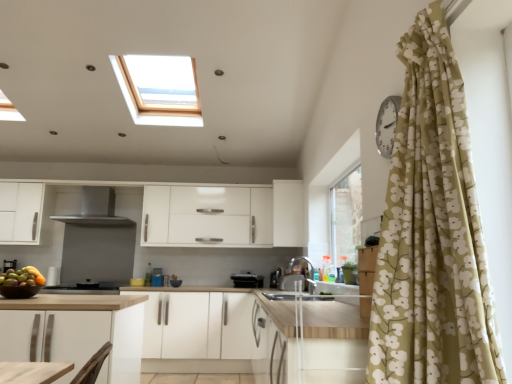
This screenshot has width=512, height=384. What do you see at coordinates (247, 280) in the screenshot?
I see `black plastic toaster at center, the fourth appliance in the top-to-bottom sequence` at bounding box center [247, 280].

What is the approximate width of white matte cabinet at center, placed as the 1th cabinetry when sorted from left to right?

white matte cabinet at center, placed as the 1th cabinetry when sorted from left to right, is 24.58 inches wide.

The height and width of the screenshot is (384, 512). What do you see at coordinates (275, 278) in the screenshot?
I see `satin black toaster at center, the 2th appliance in the bottom-to-top sequence` at bounding box center [275, 278].

I want to click on black plastic toaster at center, which is the 5th appliance from front to back, so click(x=247, y=280).

In the scene shown: What's the angular difference between black matte stove at lower center, which ranks as the sixth appliance in right-to-left order, and white matte cabinet at center, acting as the 2th cabinetry starting from the bottom,'s facing directions?

The angle between the facing direction of black matte stove at lower center, which ranks as the sixth appliance in right-to-left order, and the facing direction of white matte cabinet at center, acting as the 2th cabinetry starting from the bottom, is 90.3 degrees.

Is black matte stove at lower center, the 1th appliance viewed from the left, positioned far away from white matte cabinet at center, acting as the 2th cabinetry starting from the bottom?

black matte stove at lower center, the 1th appliance viewed from the left, is far away from white matte cabinet at center, acting as the 2th cabinetry starting from the bottom.

From the picture: From a real-world perspective, who is located higher, black matte stove at lower center, acting as the 1th appliance starting from the bottom, or white matte cabinet at center, marked as the second cabinetry in a left-to-right arrangement?

white matte cabinet at center, marked as the second cabinetry in a left-to-right arrangement.

From the image's perspective, would you say black matte stove at lower center, acting as the 1th appliance starting from the bottom, is shown under white matte cabinet at center, acting as the 2th cabinetry starting from the bottom?

Yes.

Can you confirm if white matte cabinet at center, which is counted as the first cabinetry, starting from the top, is bigger than black matte stove at lower center, acting as the 3th appliance starting from the back?

Indeed, white matte cabinet at center, which is counted as the first cabinetry, starting from the top, has a larger size compared to black matte stove at lower center, acting as the 3th appliance starting from the back.

Does white matte cabinet at center, which is counted as the first cabinetry, starting from the top, have a greater height compared to black matte stove at lower center, acting as the 3th appliance starting from the back?

Yes, white matte cabinet at center, which is counted as the first cabinetry, starting from the top, is taller than black matte stove at lower center, acting as the 3th appliance starting from the back.

Could you tell me if white matte cabinet at center, marked as the second cabinetry in a left-to-right arrangement, is facing black matte stove at lower center, the 1th appliance viewed from the left?

Yes, white matte cabinet at center, marked as the second cabinetry in a left-to-right arrangement, faces towards black matte stove at lower center, the 1th appliance viewed from the left.

From a real-world perspective, who is located higher, white matte cabinet at center, acting as the 2th cabinetry starting from the bottom, or black matte stove at lower center, positioned as the fourth appliance in front-to-back order?

white matte cabinet at center, acting as the 2th cabinetry starting from the bottom, is physically above.

Can you see satin black toaster at center, which ranks as the sixth appliance in front-to-back order, touching stainless steel range hood at center?

satin black toaster at center, which ranks as the sixth appliance in front-to-back order, and stainless steel range hood at center are clearly separated.

From the image's perspective, is satin black toaster at center, the 2th appliance in the bottom-to-top sequence, located above or below stainless steel range hood at center?

Based on their image positions, satin black toaster at center, the 2th appliance in the bottom-to-top sequence, is located beneath stainless steel range hood at center.

From a real-world perspective, is satin black toaster at center, the 5th appliance from the top, below stainless steel range hood at center?

Indeed, from a real-world perspective, satin black toaster at center, the 5th appliance from the top, is positioned beneath stainless steel range hood at center.

Can you confirm if satin black toaster at center, the 2th appliance in the bottom-to-top sequence, is thinner than stainless steel range hood at center?

Indeed, satin black toaster at center, the 2th appliance in the bottom-to-top sequence, has a lesser width compared to stainless steel range hood at center.

Is black plastic toaster at center, which is the 5th appliance from front to back, wider than white matte cabinet at center, positioned as the 1th cabinetry in bottom-to-top order?

Incorrect, the width of black plastic toaster at center, which is the 5th appliance from front to back, does not surpass that of white matte cabinet at center, positioned as the 1th cabinetry in bottom-to-top order.

Is black plastic toaster at center, which is the 5th appliance from front to back, taller or shorter than white matte cabinet at center, positioned as the 1th cabinetry in bottom-to-top order?

In the image, black plastic toaster at center, which is the 5th appliance from front to back, appears to be shorter than white matte cabinet at center, positioned as the 1th cabinetry in bottom-to-top order.

Is there a large distance between black plastic toaster at center, the second appliance positioned from the back, and white matte cabinet at center, positioned as the 1th cabinetry in bottom-to-top order?

black plastic toaster at center, the second appliance positioned from the back, is near white matte cabinet at center, positioned as the 1th cabinetry in bottom-to-top order, not far away.

Is black plastic toaster at center, the 5th appliance viewed from the right, facing towards white matte cabinet at center, which is counted as the 2th cabinetry, starting from the right?

No, black plastic toaster at center, the 5th appliance viewed from the right, is not oriented towards white matte cabinet at center, which is counted as the 2th cabinetry, starting from the right.

Is stainless steel range hood at center completely or partially inside wooden countertop at lower left?

No, stainless steel range hood at center is not a part of wooden countertop at lower left.

What are the coordinates of `countertop lying below the stainless steel range hood at center (from the image's perspective)` in the screenshot? It's located at (150, 330).

Could you tell me if wooden countertop at lower left is facing stainless steel range hood at center?

No, wooden countertop at lower left is not facing towards stainless steel range hood at center.

From the image's perspective, is wooden countertop at lower left on top of stainless steel range hood at center?

No, from the image's perspective, wooden countertop at lower left is not on top of stainless steel range hood at center.

Is satin black toaster at center, which ranks as the sixth appliance in front-to-back order, next to shiny brown bowl of fruits at lower left?

No, satin black toaster at center, which ranks as the sixth appliance in front-to-back order, is not beside shiny brown bowl of fruits at lower left.

Does satin black toaster at center, which is the first appliance in back-to-front order, come behind shiny brown bowl of fruits at lower left?

Yes, satin black toaster at center, which is the first appliance in back-to-front order, is behind shiny brown bowl of fruits at lower left.

From a real-world perspective, is satin black toaster at center, arranged as the third appliance when viewed from the left, under shiny brown bowl of fruits at lower left?

Indeed, from a real-world perspective, satin black toaster at center, arranged as the third appliance when viewed from the left, is positioned beneath shiny brown bowl of fruits at lower left.

Considering the relative sizes of satin black toaster at center, arranged as the third appliance when viewed from the left, and shiny brown bowl of fruits at lower left in the image provided, is satin black toaster at center, arranged as the third appliance when viewed from the left, wider than shiny brown bowl of fruits at lower left?

Incorrect, the width of satin black toaster at center, arranged as the third appliance when viewed from the left, does not surpass that of shiny brown bowl of fruits at lower left.

From the image's perspective, starting from the satin black coffee machine at lower left, which appliance is the 1st one above? Please provide its 2D coordinates.

[(302, 271)]

From a real-world perspective, who is located lower, metallic faucet at center, which is the 2th appliance from front to back, or satin black coffee machine at lower left?

From a 3D spatial view, metallic faucet at center, which is the 2th appliance from front to back, is below.

Considering the positions of point (291, 274) and point (5, 267), is point (291, 274) closer or farther from the camera than point (5, 267)?

Point (291, 274) is closer to the camera than point (5, 267).

From the image's perspective, starting from the white matte cabinet at center, acting as the 2th cabinetry starting from the bottom, which appliance is the 5th one below? Please provide its 2D coordinates.

[(81, 290)]

You are a GUI agent. You are given a task and a screenshot of the screen. Output one action in this format:
    pyautogui.click(x=<x>, y=<y>)
    Task: Click on the 3rd appliance to the left when counting from the white matte cabinet at center, marked as the second cabinetry in a left-to-right arrangement
    This screenshot has height=384, width=512.
    Given the screenshot: What is the action you would take?
    click(81, 290)

When comparing their distances from metallic faucet at center, placed as the 5th appliance when sorted from back to front, does shiny brown bowl of fruits at lower left or black plastic toaster at center, the fourth appliance in the top-to-bottom sequence, seem closer?

black plastic toaster at center, the fourth appliance in the top-to-bottom sequence, lies closer to metallic faucet at center, placed as the 5th appliance when sorted from back to front, than the other object.

Based on their spatial positions, is metallic faucet at center, which is the fifth appliance in left-to-right order, or black matte stove at lower center, acting as the 3th appliance starting from the back, further from wooden countertop at lower left?

black matte stove at lower center, acting as the 3th appliance starting from the back, is further to wooden countertop at lower left.

From the image, which object appears to be nearer to shiny brown bowl of fruits at lower left, satin black toaster at center, which ranks as the sixth appliance in front-to-back order, or white matte cabinet at center, marked as the second cabinetry in a left-to-right arrangement?

The object closer to shiny brown bowl of fruits at lower left is satin black toaster at center, which ranks as the sixth appliance in front-to-back order.

When comparing their distances from black plastic toaster at center, the second appliance positioned from the back, does metallic faucet at center, placed as the 5th appliance when sorted from back to front, or wooden countertop at lower left seem closer?

wooden countertop at lower left is positioned closer to the anchor black plastic toaster at center, the second appliance positioned from the back.

Based on their spatial positions, is white matte cabinet at center, which appears as the 1th cabinetry when viewed from the right, or shiny brown bowl of fruits at lower left further from metallic faucet at center, placed as the 5th appliance when sorted from back to front?

Based on the image, shiny brown bowl of fruits at lower left appears to be further to metallic faucet at center, placed as the 5th appliance when sorted from back to front.

When comparing their distances from satin silver sink at center, which is counted as the 4th appliance, starting from the back, does black matte stove at lower center, acting as the sixth appliance starting from the top, or black plastic toaster at center, the fourth appliance in the top-to-bottom sequence, seem closer?

The object closer to satin silver sink at center, which is counted as the 4th appliance, starting from the back, is black plastic toaster at center, the fourth appliance in the top-to-bottom sequence.

Based on their spatial positions, is satin black coffee machine at lower left or white matte cabinet at center, the second cabinetry viewed from the top, closer to silver metallic clock at upper right, the 6th appliance positioned from the bottom?

satin black coffee machine at lower left.

From the image, which object appears to be farther from silver metallic clock at upper right, which ranks as the 6th appliance in left-to-right order, black plastic toaster at center, the fourth appliance in the top-to-bottom sequence, or satin black coffee machine at lower left?

black plastic toaster at center, the fourth appliance in the top-to-bottom sequence, is positioned further to the anchor silver metallic clock at upper right, which ranks as the 6th appliance in left-to-right order.

Find the location of a particular element. This screenshot has height=384, width=512. fruit between satin black coffee machine at lower left and satin black toaster at center, arranged as the third appliance when viewed from the left, in the horizontal direction is located at coordinates (22, 277).

I want to click on kitchen appliance between satin black coffee machine at lower left and white matte cabinet at center, positioned as the 1th cabinetry in bottom-to-top order, in the horizontal direction, so click(x=97, y=209).

Where is `fruit between satin black coffee machine at lower left and silver metallic clock at upper right, the first appliance from the right, from left to right`? This screenshot has width=512, height=384. fruit between satin black coffee machine at lower left and silver metallic clock at upper right, the first appliance from the right, from left to right is located at coordinates (22, 277).

You are a GUI agent. You are given a task and a screenshot of the screen. Output one action in this format:
    pyautogui.click(x=<x>, y=<y>)
    Task: Click on the fruit between wooden countertop at lower left and satin silver sink at center, which is counted as the 4th appliance, starting from the back, along the z-axis
    Image resolution: width=512 pixels, height=384 pixels.
    Given the screenshot: What is the action you would take?
    tap(22, 277)